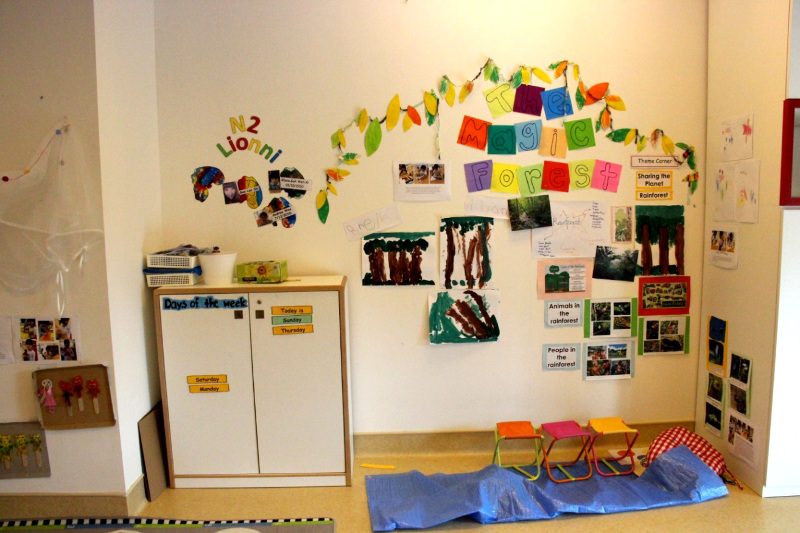
At what (x,y) coordinates should I click in order to perform the action: click on qtissue. Please return your answer as a coordinate pair (x, y). This screenshot has height=533, width=800. Looking at the image, I should click on (250, 266).